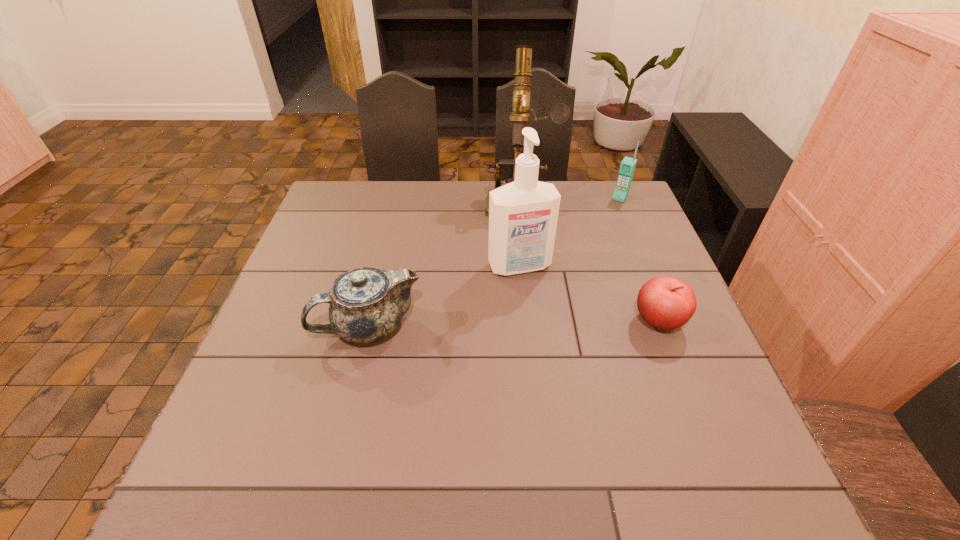
This screenshot has width=960, height=540. In order to click on free space located on the front label of the third nearest object in this screenshot , I will do `click(546, 318)`.

This screenshot has width=960, height=540. I want to click on vacant space located 0.390m at the eyepiece of the microscope, so click(516, 316).

At what (x,y) coordinates should I click in order to perform the action: click on vacant space located 0.370m at the eyepiece of the microscope. Please return your answer as a coordinate pair (x, y). The width and height of the screenshot is (960, 540). Looking at the image, I should click on (516, 310).

Where is `vacant region located 0.260m at the eyepiece of the microscope`? This screenshot has width=960, height=540. vacant region located 0.260m at the eyepiece of the microscope is located at coordinates (517, 279).

Find the location of a particular element. free region located on the keypad of the cellular telephone is located at coordinates (579, 265).

At what (x,y) coordinates should I click in order to perform the action: click on vacant space located on the keypad of the cellular telephone. Please return your answer as a coordinate pair (x, y). This screenshot has width=960, height=540. Looking at the image, I should click on (581, 263).

Locate an element on the screen. This screenshot has width=960, height=540. vacant region located 0.370m on the keypad of the cellular telephone is located at coordinates (577, 269).

Where is `microscope that is at the far edge`? microscope that is at the far edge is located at coordinates (560, 113).

Identify the location of cellular telephone that is at the far edge. The width and height of the screenshot is (960, 540). (627, 167).

At what (x,y) coordinates should I click in order to perform the action: click on object positioned at the left edge. Please return your answer as a coordinate pair (x, y). Looking at the image, I should click on (367, 304).